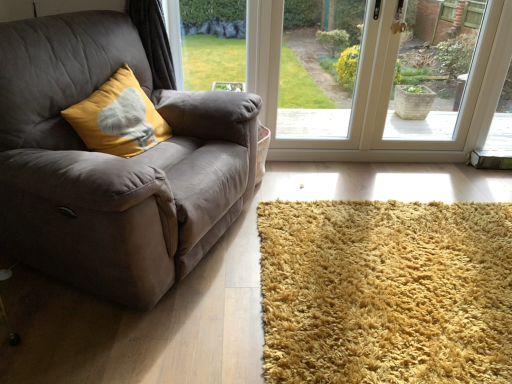
The width and height of the screenshot is (512, 384). I want to click on free area in between suede gray couch at left and shaggy golden rug at lower right, so click(x=257, y=261).